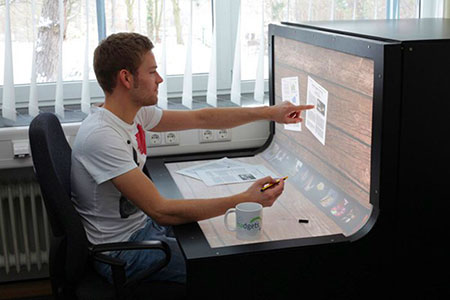
Locate an element on the screen. The image size is (450, 300). screen is located at coordinates (350, 147).